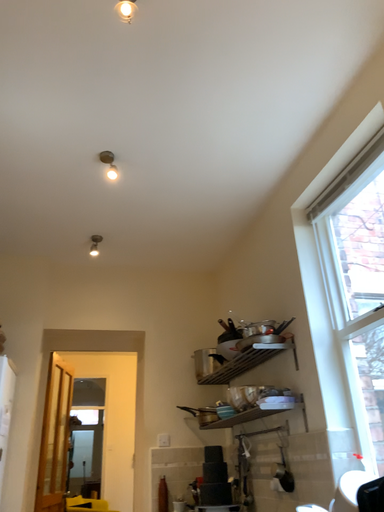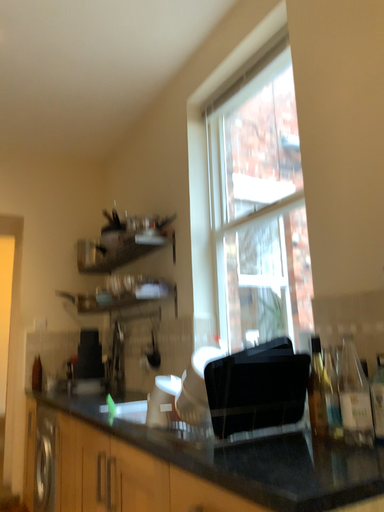
Question: Which way did the camera rotate in the video?

Choices:
 (A) rotated downward
 (B) rotated upward

Answer: (A)